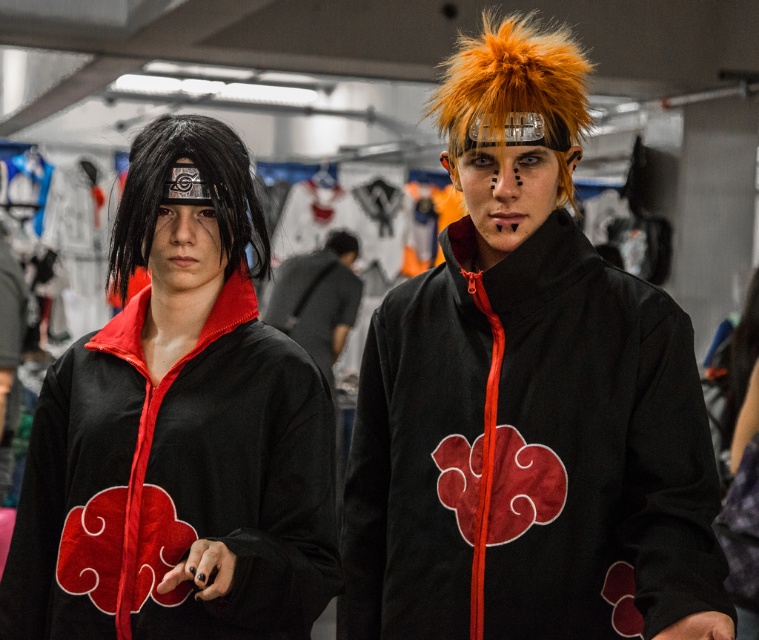
Who is more distant from viewer, (452,288) or (356,284)?

The point (356,284) is more distant.

Is velvet black jacket at upper right shorter than matte black jacket at center?

Yes, velvet black jacket at upper right is shorter than matte black jacket at center.

Describe the element at coordinates (594, 451) in the screenshot. I see `velvet black jacket at upper right` at that location.

The width and height of the screenshot is (759, 640). Identify the location of velvet black jacket at upper right. (594, 451).

How much distance is there between orange spiky wig at upper right and black synthetic wig at left?

The distance of orange spiky wig at upper right from black synthetic wig at left is 18.63 inches.

From the picture: Does orange spiky wig at upper right have a lesser height compared to black synthetic wig at left?

Incorrect, orange spiky wig at upper right's height does not fall short of black synthetic wig at left's.

What do you see at coordinates (512, 92) in the screenshot? This screenshot has height=640, width=759. I see `orange spiky wig at upper right` at bounding box center [512, 92].

The height and width of the screenshot is (640, 759). Find the location of `orange spiky wig at upper right`. orange spiky wig at upper right is located at coordinates (512, 92).

Is point (446, 88) closer to viewer compared to point (331, 333)?

Yes.

Identify the location of orange spiky wig at upper right. (512, 92).